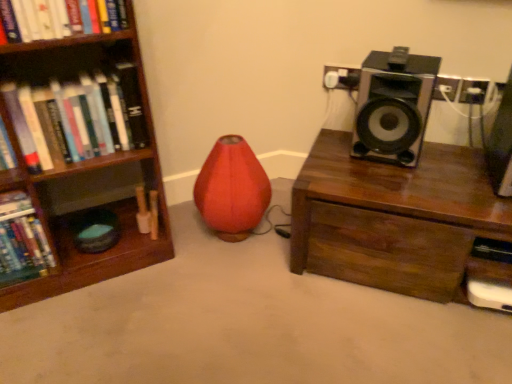
Question: Is black plastic speaker at upper right, the second speaker from the right, at the back of hardcover book at left, which is the second book from right to left?

Choices:
 (A) no
 (B) yes

Answer: (A)

Question: From a real-world perspective, is hardcover book at left, the first book in the left-to-right sequence, under black plastic speaker at upper right, which ranks as the 1th speaker in left-to-right order?

Choices:
 (A) no
 (B) yes

Answer: (B)

Question: Is hardcover book at left, which is the second book from right to left, to the right of black plastic speaker at upper right, the second speaker from the right, from the viewer's perspective?

Choices:
 (A) yes
 (B) no

Answer: (B)

Question: Considering the relative sizes of hardcover book at left, the first book in the left-to-right sequence, and black plastic speaker at upper right, which ranks as the 1th speaker in left-to-right order, in the image provided, is hardcover book at left, the first book in the left-to-right sequence, shorter than black plastic speaker at upper right, which ranks as the 1th speaker in left-to-right order,?

Choices:
 (A) yes
 (B) no

Answer: (A)

Question: From the image's perspective, is hardcover book at left, which is the second book from right to left, above black plastic speaker at upper right, the second speaker from the right?

Choices:
 (A) yes
 (B) no

Answer: (B)

Question: Does point (496, 114) appear closer or farther from the camera than point (33, 248)?

Choices:
 (A) farther
 (B) closer

Answer: (A)

Question: From a real-world perspective, is metallic silver speaker at upper right, which is the 1th speaker from right to left, above or below hardcover book at left, which is the second book from right to left?

Choices:
 (A) below
 (B) above

Answer: (B)

Question: Visually, is metallic silver speaker at upper right, which is the 1th speaker from right to left, positioned to the left or to the right of hardcover book at left, the first book in the left-to-right sequence?

Choices:
 (A) right
 (B) left

Answer: (A)

Question: Based on their sizes in the image, would you say metallic silver speaker at upper right, which is the 1th speaker from right to left, is bigger or smaller than hardcover book at left, placed as the 2th book when sorted from top to bottom?

Choices:
 (A) small
 (B) big

Answer: (B)

Question: Relative to hardcover book at left, positioned as the 1th book in right-to-left order, is black plastic speaker at upper right, the second speaker from the right, in front or behind?

Choices:
 (A) front
 (B) behind

Answer: (B)

Question: Is black plastic speaker at upper right, the second speaker from the right, bigger or smaller than hardcover book at left, acting as the first book starting from the top?

Choices:
 (A) small
 (B) big

Answer: (B)

Question: From the image's perspective, is black plastic speaker at upper right, which ranks as the 1th speaker in left-to-right order, above or below hardcover book at left, positioned as the 1th book in right-to-left order?

Choices:
 (A) above
 (B) below

Answer: (A)

Question: In terms of height, does black plastic speaker at upper right, the second speaker from the right, look taller or shorter compared to hardcover book at left, the second book ordered from the bottom?

Choices:
 (A) tall
 (B) short

Answer: (A)

Question: From their relative heights in the image, would you say matte red bean bag chair at center is taller or shorter than black plastic speaker at upper right, which ranks as the 1th speaker in left-to-right order?

Choices:
 (A) short
 (B) tall

Answer: (B)

Question: Looking at their shapes, would you say matte red bean bag chair at center is wider or thinner than black plastic speaker at upper right, the second speaker from the right?

Choices:
 (A) wide
 (B) thin

Answer: (A)